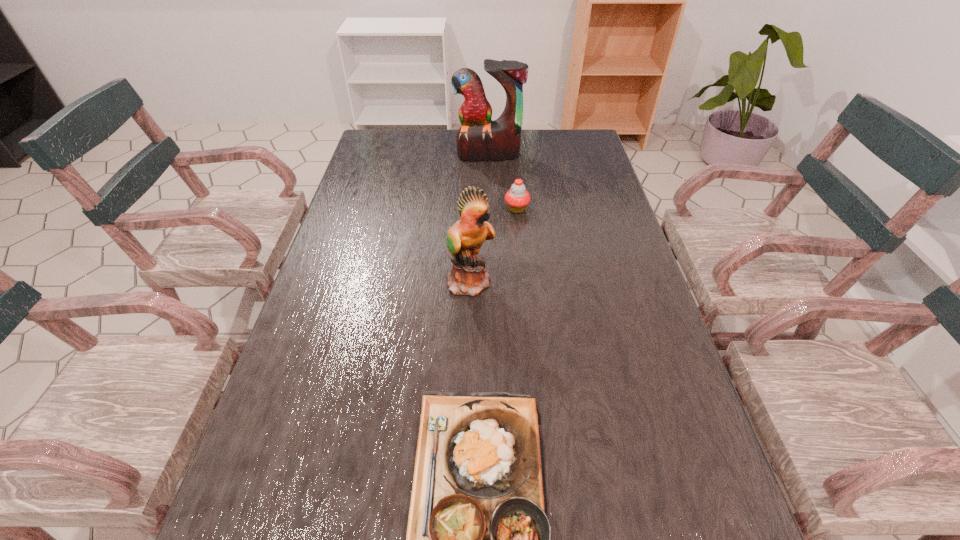
Where is `free space at the right edge of the desktop`? free space at the right edge of the desktop is located at coordinates (666, 464).

Locate an element on the screen. The width and height of the screenshot is (960, 540). vacant region at the far left corner of the desktop is located at coordinates (392, 137).

At what (x,y) coordinates should I click in order to perform the action: click on vacant area that lies between the second shortest object and the farthest object. Please return your answer as a coordinate pair (x, y). This screenshot has height=540, width=960. Looking at the image, I should click on (x=502, y=182).

In order to click on free space between the nearer parrot and the second shortest object in this screenshot , I will do `click(493, 245)`.

You are a GUI agent. You are given a task and a screenshot of the screen. Output one action in this format:
    pyautogui.click(x=<x>, y=<y>)
    Task: Click on the object that can be found as the closest to the third tallest object
    
    Given the screenshot: What is the action you would take?
    pyautogui.click(x=468, y=276)

Locate which object ranks third in proximity to the third farthest object. Please provide its 2D coordinates. Your answer should be formatted as a tuple, i.e. [(x, y)], where the tuple contains the x and y coordinates of a point satisfying the conditions above.

[(479, 138)]

At what (x,y) coordinates should I click in order to perform the action: click on vacant region that satisfies the following two spatial constraints: 1. at the face of the farther parrot; 2. on the front-facing side of the nearer parrot. Please return your answer as a coordinate pair (x, y). Looking at the image, I should click on (492, 281).

This screenshot has width=960, height=540. What are the coordinates of `free spot that satisfies the following two spatial constraints: 1. at the face of the cupcake; 2. on the left side of the farthest object` in the screenshot? It's located at (490, 209).

You are a GUI agent. You are given a task and a screenshot of the screen. Output one action in this format:
    pyautogui.click(x=<x>, y=<y>)
    Task: Click on the vacant area in the image that satisfies the following two spatial constraints: 1. at the face of the second shortest object; 2. on the right side of the farthest object
    The height and width of the screenshot is (540, 960).
    Given the screenshot: What is the action you would take?
    [x=490, y=209]

You are a GUI agent. You are given a task and a screenshot of the screen. Output one action in this format:
    pyautogui.click(x=<x>, y=<y>)
    Task: Click on the vacant space that satisfies the following two spatial constraints: 1. at the face of the farther parrot; 2. on the front-facing side of the nearer parrot
    The width and height of the screenshot is (960, 540).
    Given the screenshot: What is the action you would take?
    pyautogui.click(x=492, y=281)